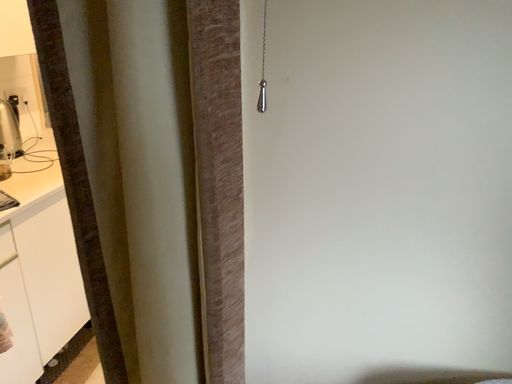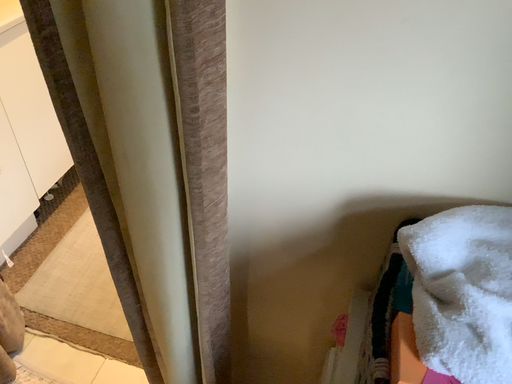
Question: Which way did the camera rotate in the video?

Choices:
 (A) rotated downward
 (B) rotated upward

Answer: (A)